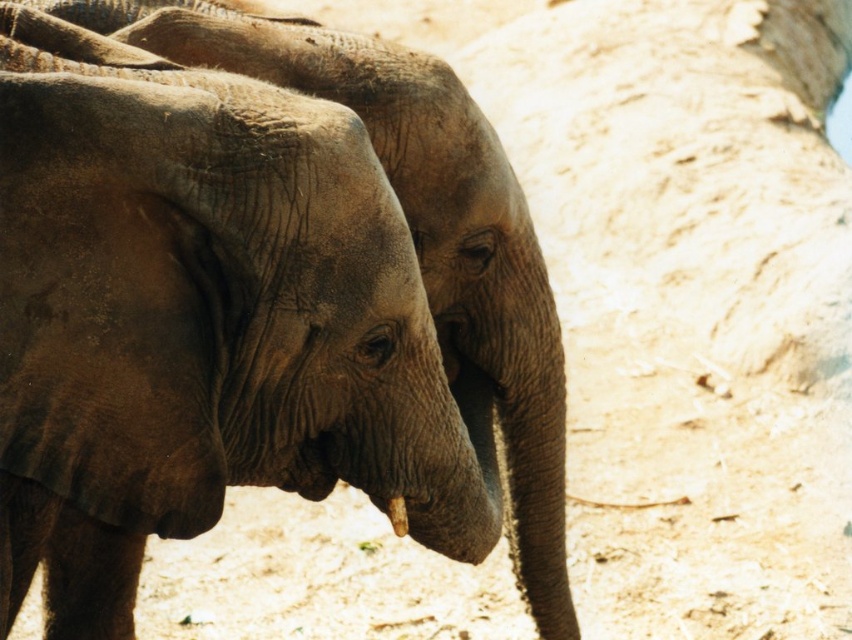
Who is lower down, gray textured elephant at center or white matte tusk at lower center?

Positioned lower is white matte tusk at lower center.

Does gray textured elephant at center have a larger size compared to white matte tusk at lower center?

Yes, gray textured elephant at center is bigger than white matte tusk at lower center.

The width and height of the screenshot is (852, 640). What are the coordinates of `gray textured elephant at center` in the screenshot? It's located at (419, 230).